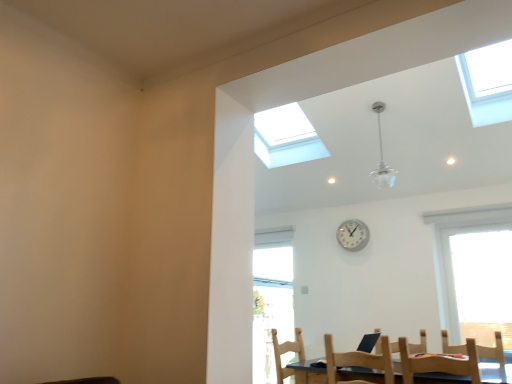
Question: From a real-world perspective, relative to white plastic clock at center, is light brown wooden chair at lower center, marked as the third chair in a right-to-left arrangement, vertically above or below?

Choices:
 (A) above
 (B) below

Answer: (B)

Question: In terms of height, does light brown wooden chair at lower center, marked as the third chair in a right-to-left arrangement, look taller or shorter compared to white plastic clock at center?

Choices:
 (A) tall
 (B) short

Answer: (A)

Question: Estimate the real-world distances between objects in this image. Which object is farther from the wooden chair at lower right, acting as the second chair starting from the left?

Choices:
 (A) transparent glass skylight at upper center, the second window positioned from the front
 (B) white plastic clock at center
 (C) wooden chair at lower right, which is counted as the 3th chair, starting from the left
 (D) transparent glass window at upper right, the first window when ordered from right to left
 (E) clear glass chandelier at upper center

Answer: (A)

Question: Based on their relative distances, which object is farther from the white plastic clock at center?

Choices:
 (A) transparent glass window at upper right, the first window positioned from the front
 (B) transparent glass skylight at upper center, placed as the 1th window when sorted from back to front
 (C) light brown wooden chair at lower center, which is counted as the 1th chair, starting from the left
 (D) clear glass chandelier at upper center
 (E) wooden chair at lower right, positioned as the second chair in right-to-left order

Answer: (E)